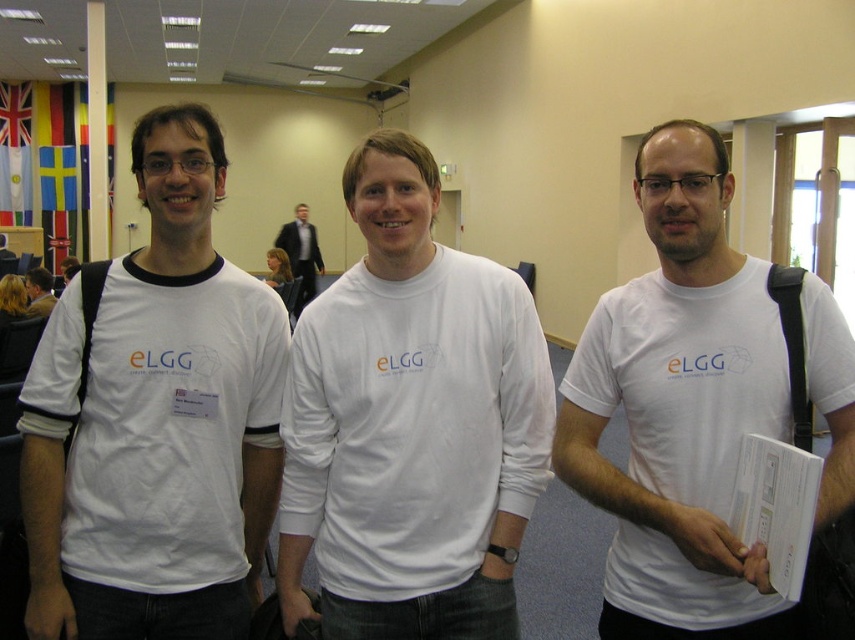
You are standing at the origin of the coordinate system in the room. You see two points marked in the image, point (196,481) and point (36,305). Which point is closer to you?

Point (36,305) is closer to you because it has a smaller y coordinate, meaning it is closer to the origin along the y axis.

You are standing in the conference room and want to take a photo of the point at coordinates point (715,628). If your camera has a focal length of 50mm and you are 1.46 meters away from the point, what is the approximate angle of view required to capture the point in the center of the photo?

The point (715,628) is 1.46 meters away from the camera. Using the formula for angle of view, the required angle can be calculated to ensure the point is centered.